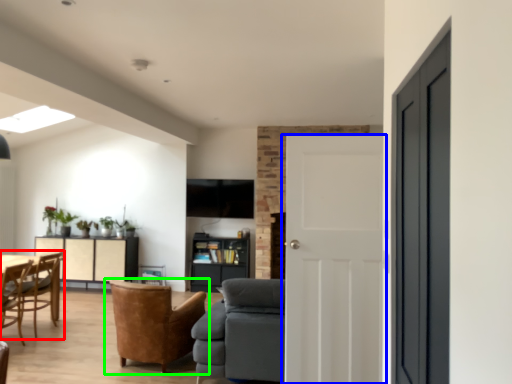
Question: Which object is positioned closest to chair (highlighted by a red box)? Select from door (highlighted by a blue box) and chair (highlighted by a green box).

Choices:
 (A) door
 (B) chair

Answer: (B)